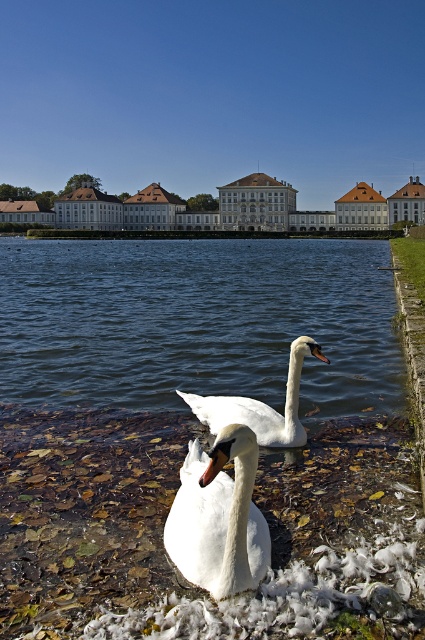
Question: Which point is closer to the camera?

Choices:
 (A) (292, 358)
 (B) (187, 344)

Answer: (A)

Question: Among these points, which one is farthest from the camera?

Choices:
 (A) (197, 541)
 (B) (300, 426)

Answer: (B)

Question: Is white matte swan at lower center to the left of white feathered swan at center from the viewer's perspective?

Choices:
 (A) yes
 (B) no

Answer: (A)

Question: Can you confirm if white matte swan at lower center is wider than white feathered swan at center?

Choices:
 (A) yes
 (B) no

Answer: (B)

Question: Among these objects, which one is nearest to the camera?

Choices:
 (A) clear water at center
 (B) white matte swan at lower center

Answer: (B)

Question: Does clear water at center have a greater width compared to white feathered swan at center?

Choices:
 (A) yes
 (B) no

Answer: (A)